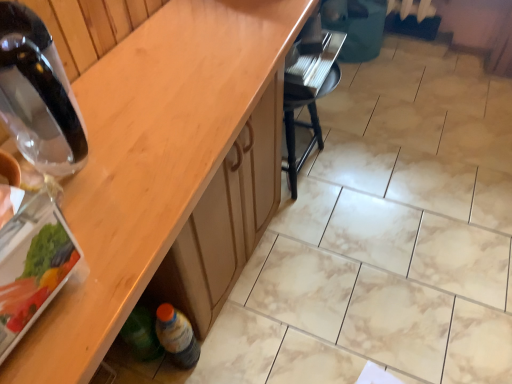
Find the location of a particular element. vacant area that is in front of transparent glass bottle at left, which is the second bottle from back to front is located at coordinates 105,241.